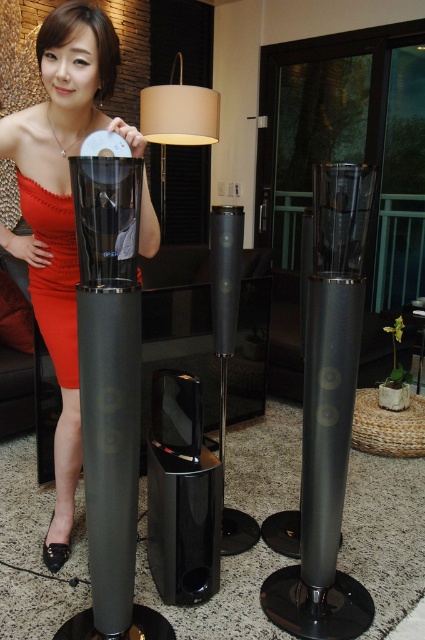
Question: Which is farther from the matte black dress at center?

Choices:
 (A) matte red dress at left
 (B) matte beige lampshade at center
 (C) beige fabric lampshade at upper center
 (D) glossy black speaker at center

Answer: (B)

Question: Does matte black dress at center appear on the left side of matte red dress at left?

Choices:
 (A) no
 (B) yes

Answer: (A)

Question: Can you confirm if matte beige lampshade at center is smaller than beige fabric lampshade at upper center?

Choices:
 (A) yes
 (B) no

Answer: (B)

Question: Does matte beige lampshade at center appear on the right side of beige fabric lampshade at upper center?

Choices:
 (A) no
 (B) yes

Answer: (A)

Question: Which of the following is the farthest from the observer?

Choices:
 (A) matte beige lampshade at center
 (B) glossy black speaker at center
 (C) beige fabric lampshade at upper center

Answer: (A)

Question: Which object appears closest to the camera in this image?

Choices:
 (A) matte black dress at center
 (B) matte red dress at left
 (C) matte beige lampshade at center

Answer: (A)